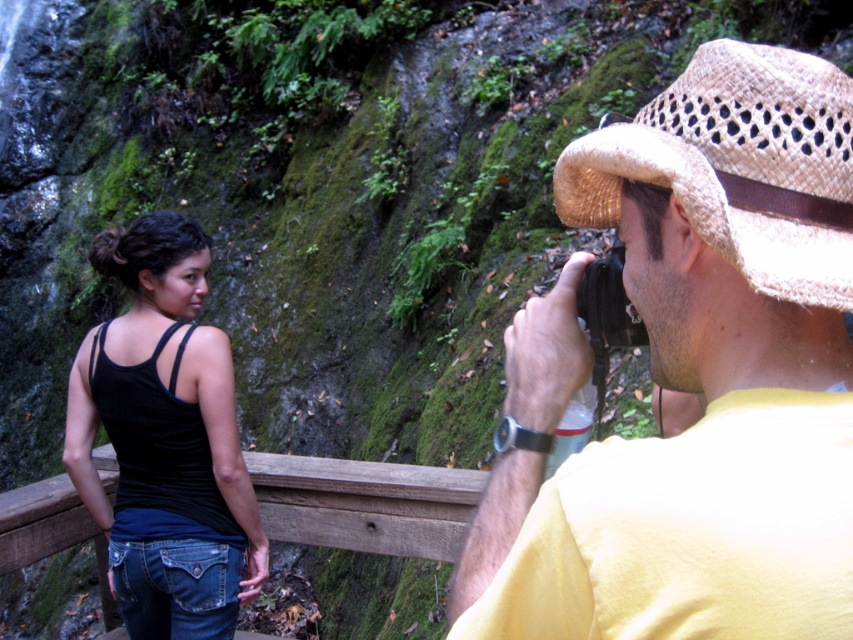
Looking at this image, between beige straw hat at upper right and woven straw cowboy hat at upper right, which one is positioned lower?

beige straw hat at upper right is lower down.

Does beige straw hat at upper right appear on the right side of woven straw cowboy hat at upper right?

Incorrect, beige straw hat at upper right is not on the right side of woven straw cowboy hat at upper right.

Where is `beige straw hat at upper right`? The width and height of the screenshot is (853, 640). beige straw hat at upper right is located at coordinates (691, 376).

Is beige straw hat at upper right above black matte tank top at center?

Yes.

Who is lower down, beige straw hat at upper right or black matte tank top at center?

black matte tank top at center is below.

Describe the element at coordinates (691, 376) in the screenshot. I see `beige straw hat at upper right` at that location.

This screenshot has width=853, height=640. In order to click on beige straw hat at upper right in this screenshot , I will do `click(691, 376)`.

Is point (175, 552) behind point (695, 88)?

Yes, point (175, 552) is farther from viewer.

Does black matte tank top at center have a lesser height compared to woven straw cowboy hat at upper right?

No, black matte tank top at center is not shorter than woven straw cowboy hat at upper right.

Is point (149, 561) behind point (840, 77)?

Yes, point (149, 561) is farther from viewer.

At what (x,y) coordinates should I click in order to perform the action: click on black matte tank top at center. Please return your answer as a coordinate pair (x, y). Image resolution: width=853 pixels, height=640 pixels. Looking at the image, I should click on (165, 440).